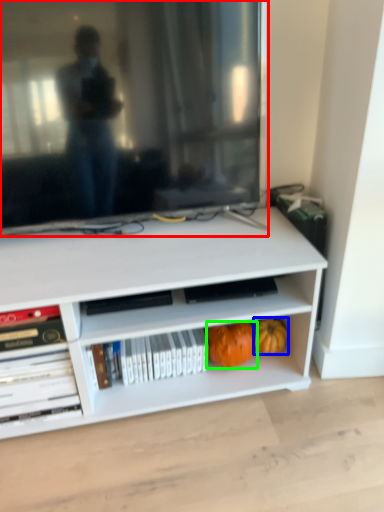
Question: Estimate the real-world distances between objects in this image. Which object is farther from television (highlighted by a red box), pumpkin (highlighted by a blue box) or pumpkin (highlighted by a green box)?

Choices:
 (A) pumpkin
 (B) pumpkin

Answer: (A)